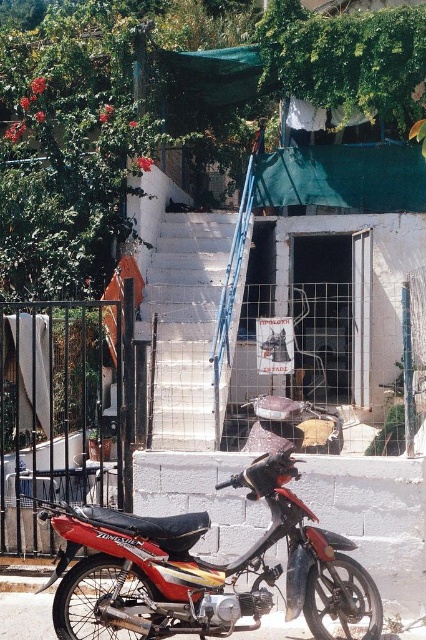
Can you confirm if shiny red motorcycle at lower left is wider than black metal fence at left?

Correct, the width of shiny red motorcycle at lower left exceeds that of black metal fence at left.

Based on the photo, does shiny red motorcycle at lower left have a lesser height compared to black metal fence at left?

Yes.

Locate an element on the screen. shiny red motorcycle at lower left is located at coordinates (209, 566).

Describe the element at coordinates (60, 412) in the screenshot. I see `black metal fence at left` at that location.

Can you confirm if black metal fence at left is bigger than white concrete stairs at center?

Indeed, black metal fence at left has a larger size compared to white concrete stairs at center.

I want to click on black metal fence at left, so click(60, 412).

Is shiny red motorcycle at lower left smaller than white concrete stairs at center?

Yes, shiny red motorcycle at lower left is smaller than white concrete stairs at center.

Which is more to the left, shiny red motorcycle at lower left or white concrete stairs at center?

Positioned to the left is white concrete stairs at center.

The image size is (426, 640). I want to click on shiny red motorcycle at lower left, so click(209, 566).